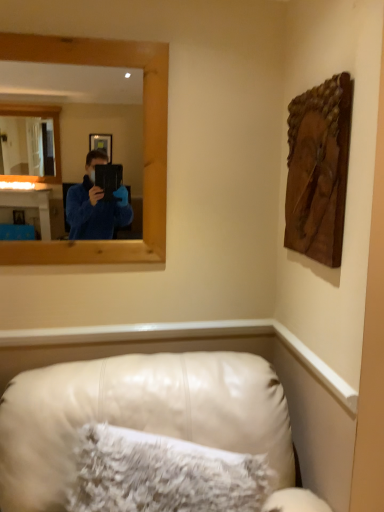
This screenshot has width=384, height=512. What do you see at coordinates (143, 417) in the screenshot?
I see `leather couch at lower center` at bounding box center [143, 417].

This screenshot has width=384, height=512. What do you see at coordinates (85, 111) in the screenshot? I see `wooden frame at upper left` at bounding box center [85, 111].

You are a GUI agent. You are given a task and a screenshot of the screen. Output one action in this format:
    pyautogui.click(x=<x>, y=<y>)
    Task: Click on the leather couch at lower center
    
    Given the screenshot: What is the action you would take?
    pyautogui.click(x=143, y=417)

Is wooden frame at upper left further to camera compared to white fluffy pillow at lower center?

Yes, it is.

Is white fluffy pillow at lower center located within wooden frame at upper left?

That's incorrect, white fluffy pillow at lower center is not inside wooden frame at upper left.

Between wooden frame at upper left and white fluffy pillow at lower center, which one has more height?

With more height is wooden frame at upper left.

Could you tell me if wooden frame at upper left is facing white fluffy pillow at lower center?

No.

Is there a large distance between wooden frame at upper left and leather couch at lower center?

Yes, wooden frame at upper left is far from leather couch at lower center.

From the image's perspective, who appears lower, wooden frame at upper left or leather couch at lower center?

leather couch at lower center, from the image's perspective.

Looking at this image, between wooden frame at upper left and leather couch at lower center, which one has smaller width?

wooden frame at upper left is thinner.

How many degrees apart are the facing directions of wooden frame at upper left and leather couch at lower center?

0.00372 degrees.

Is leather couch at lower center beside wooden frame at upper left?

No, leather couch at lower center is not touching wooden frame at upper left.

Which object is positioned more to the left, leather couch at lower center or wooden frame at upper left?

wooden frame at upper left is more to the left.

From a real-world perspective, who is located higher, wooden carving at upper right or wooden frame at upper left?

wooden frame at upper left is physically above.

How far apart are wooden carving at upper right and wooden frame at upper left?

wooden carving at upper right is 3.06 meters away from wooden frame at upper left.

Is wooden carving at upper right not close to wooden frame at upper left?

Yes, wooden carving at upper right and wooden frame at upper left are located far from each other.

Which of these two, wooden carving at upper right or wooden frame at upper left, is smaller?

wooden carving at upper right.

This screenshot has height=512, width=384. I want to click on pillow that is on the right side of wooden frame at upper left, so click(162, 474).

Would you consider white fluffy pillow at lower center to be distant from wooden frame at upper left?

Yes, white fluffy pillow at lower center and wooden frame at upper left are quite far apart.

Does white fluffy pillow at lower center appear on the right side of wooden frame at upper left?

Indeed, white fluffy pillow at lower center is positioned on the right side of wooden frame at upper left.

From the picture: Is white fluffy pillow at lower center situated inside wooden frame at upper left or outside?

white fluffy pillow at lower center is not inside wooden frame at upper left, it's outside.

From the image's perspective, which is above, wooden frame at upper left or wooden carving at upper right?

From the image's view, wooden frame at upper left is above.

Consider the image. Between wooden frame at upper left and wooden carving at upper right, which one has larger size?

With larger size is wooden frame at upper left.

Can you confirm if wooden frame at upper left is positioned to the right of wooden carving at upper right?

Incorrect, wooden frame at upper left is not on the right side of wooden carving at upper right.

Is wooden frame at upper left oriented away from wooden carving at upper right?

No, wooden frame at upper left is not facing away from wooden carving at upper right.

From their relative heights in the image, would you say white fluffy pillow at lower center is taller or shorter than wooden carving at upper right?

Clearly, white fluffy pillow at lower center is shorter compared to wooden carving at upper right.

Is white fluffy pillow at lower center facing towards wooden carving at upper right?

No, white fluffy pillow at lower center does not turn towards wooden carving at upper right.

From the image's perspective, which one is positioned higher, white fluffy pillow at lower center or wooden carving at upper right?

From the image's view, wooden carving at upper right is above.

From a real-world perspective, who is located higher, white fluffy pillow at lower center or wooden carving at upper right?

wooden carving at upper right.

Find the location of a particular element. mirror above the white fluffy pillow at lower center (from the image's perspective) is located at coordinates (85, 111).

Locate an element on the screen. This screenshot has height=512, width=384. furniture located in front of the wooden frame at upper left is located at coordinates (143, 417).

When comparing their distances from leather couch at lower center, does wooden frame at upper left or wooden carving at upper right seem further?

Based on the image, wooden frame at upper left appears to be further to leather couch at lower center.

From the image, which object appears to be nearer to wooden frame at upper left, white fluffy pillow at lower center or wooden carving at upper right?

wooden carving at upper right is closer to wooden frame at upper left.

Which object lies further to the anchor point white fluffy pillow at lower center, leather couch at lower center or wooden frame at upper left?

Among the two, wooden frame at upper left is located further to white fluffy pillow at lower center.

Which object lies nearer to the anchor point wooden carving at upper right, wooden frame at upper left or white fluffy pillow at lower center?

Among the two, white fluffy pillow at lower center is located nearer to wooden carving at upper right.

Estimate the real-world distances between objects in this image. Which object is closer to wooden frame at upper left, wooden carving at upper right or white fluffy pillow at lower center?

wooden carving at upper right is positioned closer to the anchor wooden frame at upper left.

Based on their spatial positions, is white fluffy pillow at lower center or wooden carving at upper right closer to leather couch at lower center?

The object closer to leather couch at lower center is white fluffy pillow at lower center.

Which object lies nearer to the anchor point wooden carving at upper right, leather couch at lower center or white fluffy pillow at lower center?

leather couch at lower center is positioned closer to the anchor wooden carving at upper right.

From the image, which object appears to be farther from wooden carving at upper right, white fluffy pillow at lower center or wooden frame at upper left?

Based on the image, wooden frame at upper left appears to be further to wooden carving at upper right.

The height and width of the screenshot is (512, 384). I want to click on pillow between wooden frame at upper left and leather couch at lower center from top to bottom, so click(x=162, y=474).

Where is `picture frame between wooden frame at upper left and white fluffy pillow at lower center vertically`? This screenshot has width=384, height=512. picture frame between wooden frame at upper left and white fluffy pillow at lower center vertically is located at coordinates (318, 169).

Find the location of a particular element. picture frame between wooden frame at upper left and leather couch at lower center vertically is located at coordinates (318, 169).

Identify the location of pillow between wooden carving at upper right and leather couch at lower center vertically. (162, 474).